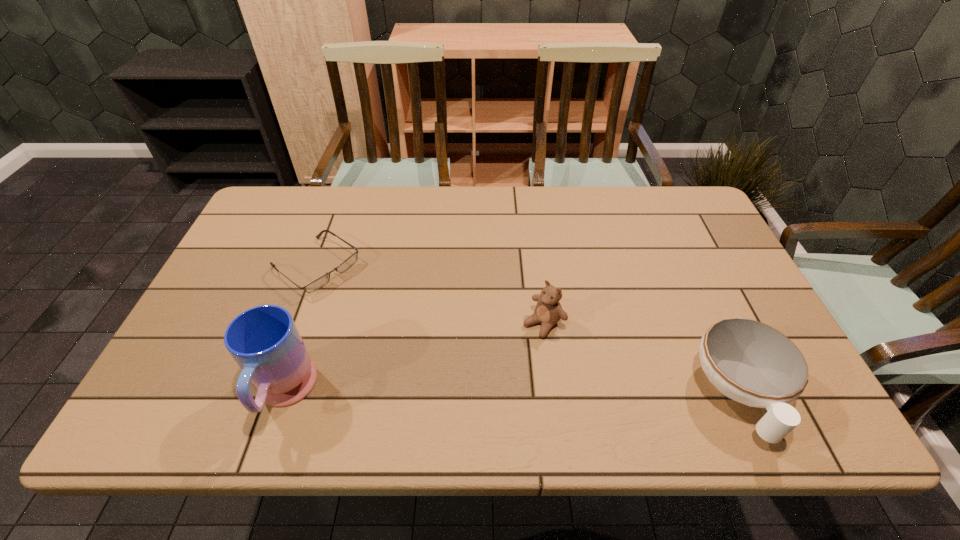
Locate an element on the screen. The height and width of the screenshot is (540, 960). mug is located at coordinates (264, 341).

Identify the location of the rightmost object. (752, 363).

Image resolution: width=960 pixels, height=540 pixels. In order to click on the second shortest object in this screenshot , I will do `click(752, 363)`.

At what (x,y) coordinates should I click in order to perform the action: click on the farthest object. Please return your answer as a coordinate pair (x, y). Image resolution: width=960 pixels, height=540 pixels. Looking at the image, I should click on (323, 280).

What are the coordinates of `spectacles` in the screenshot? It's located at (323, 280).

You are a GUI agent. You are given a task and a screenshot of the screen. Output one action in this format:
    pyautogui.click(x=<x>, y=<y>)
    Task: Click on the teddy bear
    
    Given the screenshot: What is the action you would take?
    pyautogui.click(x=548, y=311)

You are a GUI agent. You are given a task and a screenshot of the screen. Output one action in this format:
    pyautogui.click(x=<x>, y=<y>)
    Task: Click on the second farthest object
    Image resolution: width=960 pixels, height=540 pixels.
    Given the screenshot: What is the action you would take?
    pyautogui.click(x=548, y=311)

This screenshot has height=540, width=960. What are the coordinates of `vacant space located 0.290m on the front-facing side of the farthest object` in the screenshot? It's located at (421, 342).

At what (x,y) coordinates should I click in order to perform the action: click on blank area located 0.380m on the front-facing side of the farthest object. Please return your answer as a coordinate pair (x, y). The width and height of the screenshot is (960, 540). Looking at the image, I should click on (449, 363).

Locate an element on the screen. The height and width of the screenshot is (540, 960). vacant space situated on the front-facing side of the farthest object is located at coordinates (364, 301).